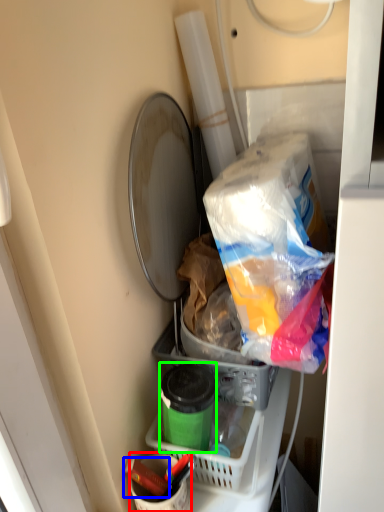
Question: Which is farther away from bucket (highlighted by a red box)? crayon (highlighted by a blue box) or bottle (highlighted by a green box)?

Choices:
 (A) crayon
 (B) bottle

Answer: (B)